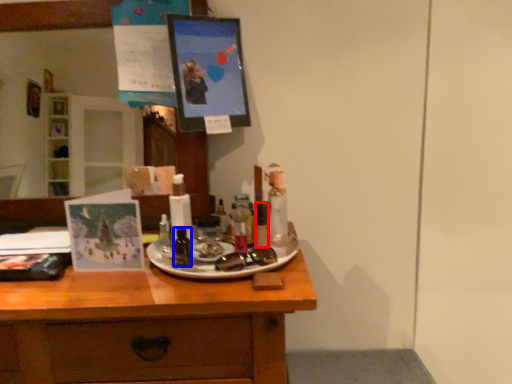
Question: Among these objects, which one is nearest to the camera, toiletry (highlighted by a red box) or toiletry (highlighted by a blue box)?

Choices:
 (A) toiletry
 (B) toiletry

Answer: (B)